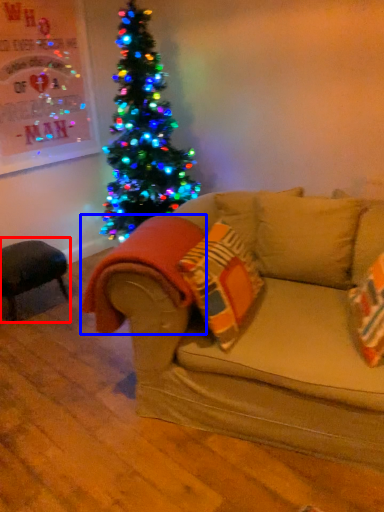
Question: Among these objects, which one is nearest to the camera, swivel chair (highlighted by a red box) or blanket (highlighted by a blue box)?

Choices:
 (A) swivel chair
 (B) blanket

Answer: (B)